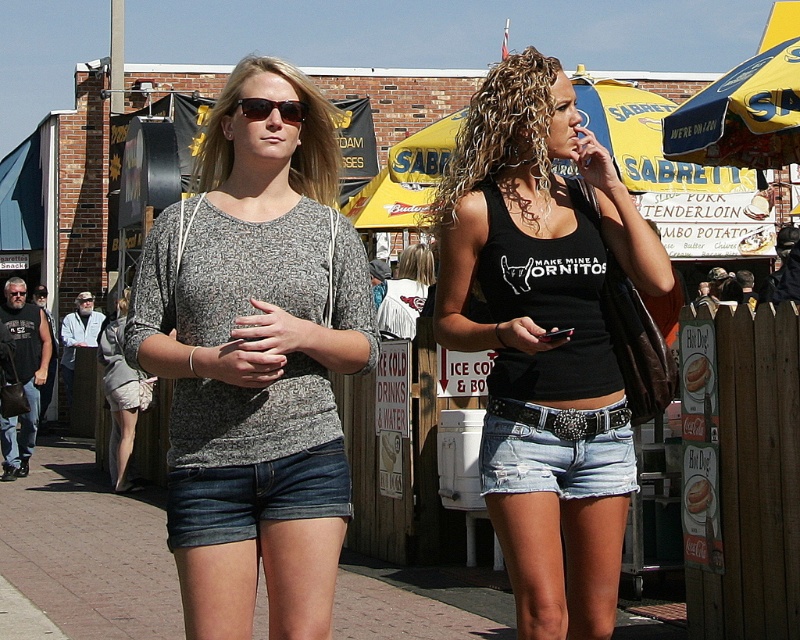
Based on the scene description, where is the black matte tank top at center located in the image?

The black matte tank top at center is located at point coordinates of 0.528 on the x axis and 0.681 on the y axis.

You are a photographer trying to capture a closeup of the black matte tank top at center and the matte black sunglasses at center. Which one should you focus on first if you want to ensure both are in focus?

The black matte tank top at center is below matte black sunglasses at center, so you should focus on the matte black sunglasses at center first to ensure both are in focus.

Consider the image. You are standing at the point with coordinates point (284,109) and want to walk towards the point with coordinates point (296,310). Which direction should you move in?

You should move forward because point (296,310) is in front of point (284,109).